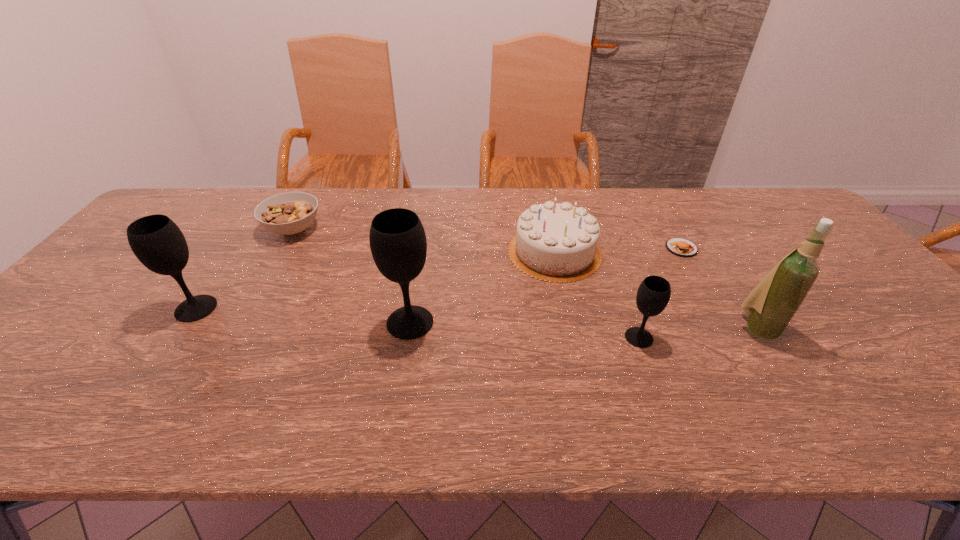
The image size is (960, 540). I want to click on the leftmost wineglass, so click(158, 243).

This screenshot has height=540, width=960. Find the location of `the second shortest wineglass`. the second shortest wineglass is located at coordinates (158, 243).

At what (x,y) coordinates should I click in order to perform the action: click on the second wineglass from left to right. Please return your answer as a coordinate pair (x, y). Looking at the image, I should click on (398, 244).

The height and width of the screenshot is (540, 960). I want to click on the rightmost wineglass, so click(653, 295).

Identify the location of the sixth tallest object. Image resolution: width=960 pixels, height=540 pixels. [290, 213].

This screenshot has width=960, height=540. Find the location of `patty`. patty is located at coordinates [x=682, y=247].

At what (x,y) coordinates should I click in order to perform the action: click on wine bottle. Please return your answer as a coordinate pair (x, y). The width and height of the screenshot is (960, 540). Looking at the image, I should click on (772, 304).

Locate an element on the screen. This screenshot has width=960, height=540. birthday cake is located at coordinates (555, 242).

Identify the location of free region located on the left of the leftmost wineglass. (125, 308).

What are the coordinates of `vacant space positioned 0.200m on the back of the third object from left to right` in the screenshot? It's located at (420, 257).